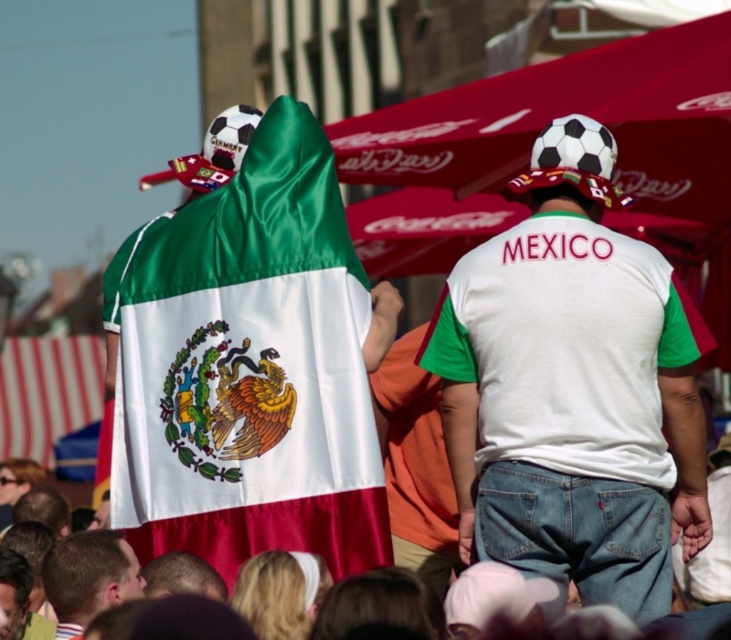
Question: Can you confirm if satin mexican flag at center is thinner than white cotton t-shirt at center?

Choices:
 (A) yes
 (B) no

Answer: (B)

Question: Which point appears closest to the camera in this image?

Choices:
 (A) (151, 520)
 (B) (700, 490)

Answer: (A)

Question: Which object appears farthest from the camera in this image?

Choices:
 (A) white cotton t-shirt at center
 (B) satin mexican flag at center

Answer: (B)

Question: Does satin mexican flag at center have a larger size compared to white cotton t-shirt at center?

Choices:
 (A) yes
 (B) no

Answer: (B)

Question: Considering the relative positions of satin mexican flag at center and white cotton t-shirt at center in the image provided, where is satin mexican flag at center located with respect to white cotton t-shirt at center?

Choices:
 (A) below
 (B) above

Answer: (A)

Question: Which point appears farthest from the camera in this image?

Choices:
 (A) (675, 387)
 (B) (162, 336)

Answer: (A)